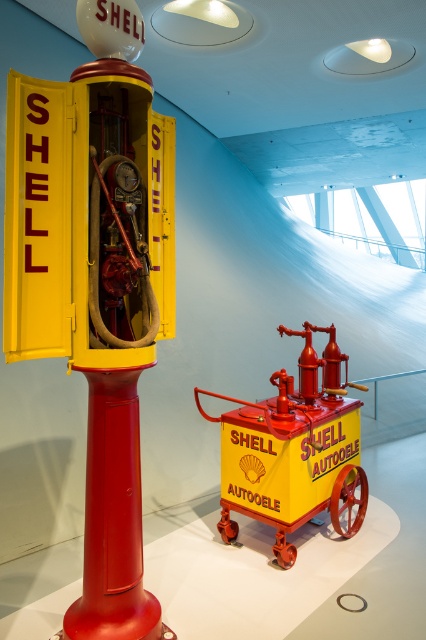
Which is more to the right, metallic yellow fire truck at center or matte yellow cart at center?

matte yellow cart at center is more to the right.

Does point (92, 548) come farther from viewer compared to point (264, 422)?

No, it is in front of (264, 422).

Where is `metallic yellow fire truck at center`? This screenshot has width=426, height=640. metallic yellow fire truck at center is located at coordinates (95, 282).